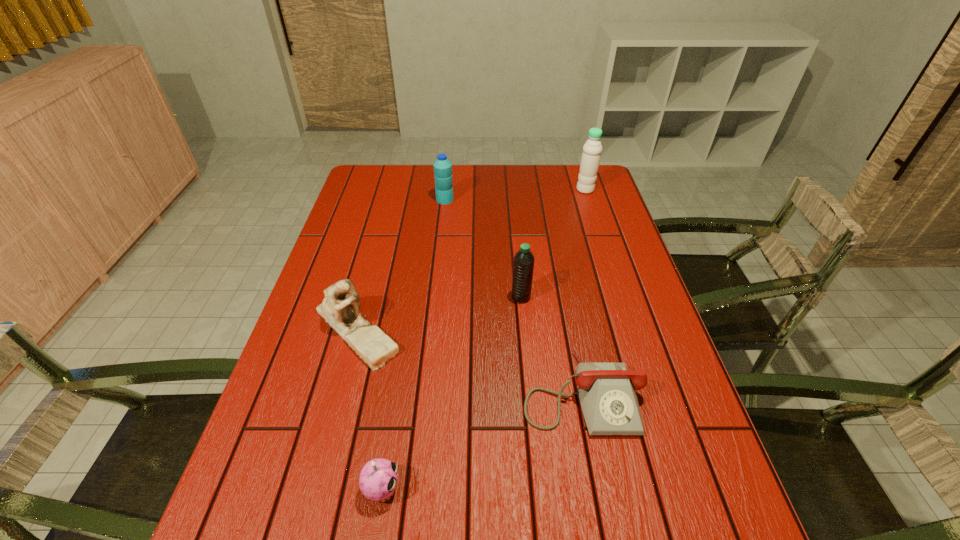
The width and height of the screenshot is (960, 540). I want to click on free location at the left edge, so click(255, 523).

Where is `vacant space at the right edge of the desktop`? This screenshot has height=540, width=960. vacant space at the right edge of the desktop is located at coordinates (583, 272).

Identify the location of free space at the far right corner of the desktop. 557,171.

Identify the location of free point between the second water bottle from right to left and the shortest object. (551, 345).

In order to click on vacant area between the nearest water bottle and the second shortest object in this screenshot , I will do 451,393.

What are the coordinates of `free space between the figurine and the farthest water bottle` in the screenshot? It's located at pyautogui.click(x=470, y=259).

Identify the location of unoccupied position between the nearest object and the nearest water bottle. pyautogui.click(x=451, y=393).

Find the location of `unoccupied position between the figurine and the second water bottle from left to right`. unoccupied position between the figurine and the second water bottle from left to right is located at coordinates [439, 313].

Where is `vacant area that lies between the leftmost water bottle and the rightmost water bottle`? vacant area that lies between the leftmost water bottle and the rightmost water bottle is located at coordinates (515, 194).

Where is `free space between the second water bottle from left to right and the figurine`? This screenshot has height=540, width=960. free space between the second water bottle from left to right and the figurine is located at coordinates (439, 313).